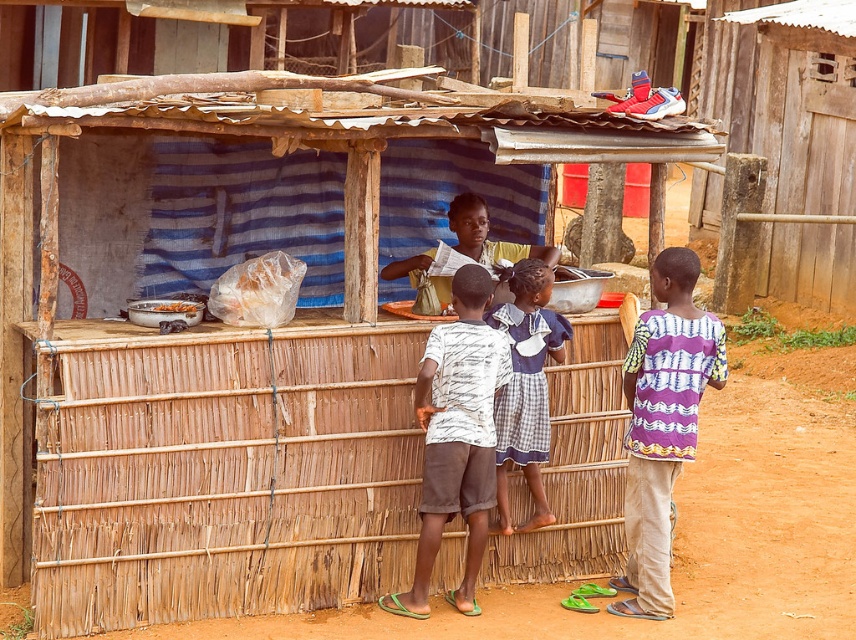
You are a customer at the stall and want to see both the purple woven shirt at right and the white cotton shirt at center. Which one is blocking your view of the other?

The purple woven shirt at right is blocking the view of the white cotton shirt at center because the white cotton shirt at center is behind the purple woven shirt at right.